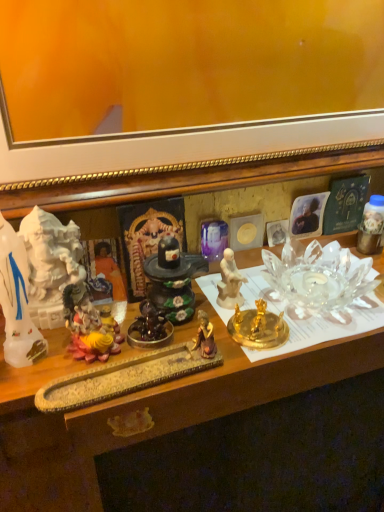
You are a GUI agent. You are given a task and a screenshot of the screen. Output one action in this format:
    pyautogui.click(x=<x>, y=<y>)
    Task: Click on the free spot in front of shiny dark brown statue at center, the 3th toy viewed from the left
    This screenshot has width=384, height=512.
    Given the screenshot: What is the action you would take?
    pyautogui.click(x=133, y=380)